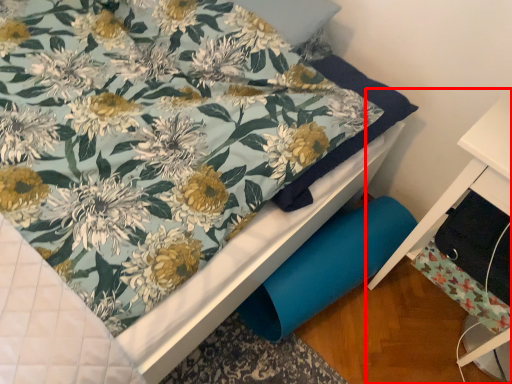
Question: From the image's perspective, where is furniture (annotated by the red box) located relative to drawer?

Choices:
 (A) above
 (B) below

Answer: (B)